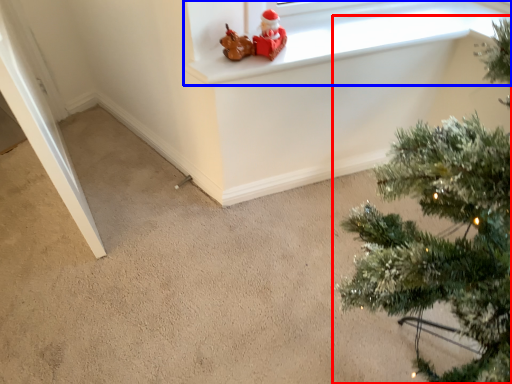
Question: Among these objects, which one is nearest to the camera, christmas tree (highlighted by a red box) or window frame (highlighted by a blue box)?

Choices:
 (A) christmas tree
 (B) window frame

Answer: (A)